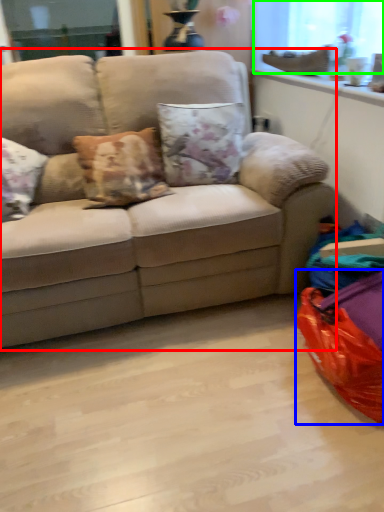
Question: Which object is positioned closest to studio couch (highlighted by a red box)? Select from bean bag chair (highlighted by a blue box) and window screen (highlighted by a green box).

Choices:
 (A) bean bag chair
 (B) window screen

Answer: (A)